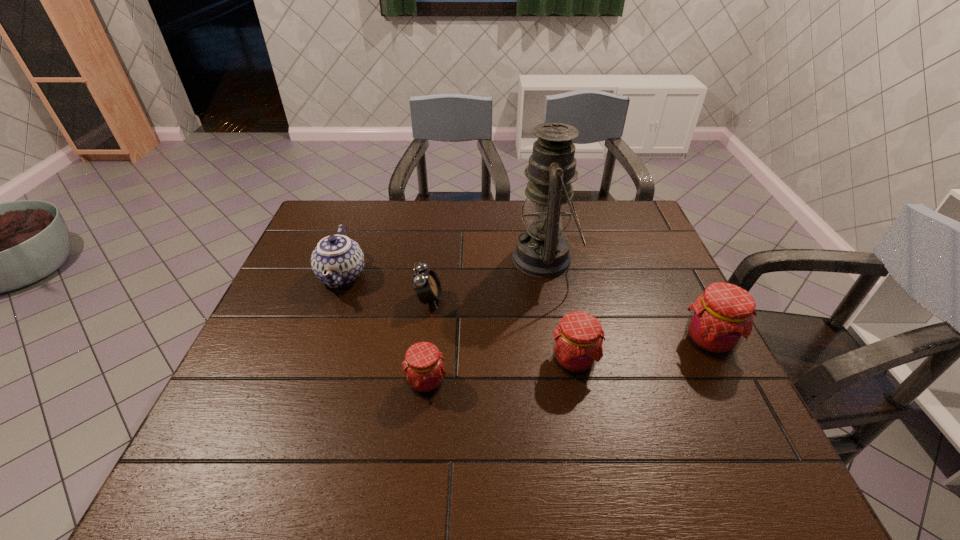
Locate an element on the screen. vacant area that lies between the tallest jam and the leftmost object is located at coordinates (525, 309).

Image resolution: width=960 pixels, height=540 pixels. I want to click on object that stands as the closest to the second jam from left to right, so click(x=542, y=251).

Locate an element on the screen. object that stands as the fifth closest to the tallest object is located at coordinates click(337, 261).

Locate which jam is the second closest to the alarm clock. Please provide its 2D coordinates. Your answer should be formatted as a tuple, i.e. [(x, y)], where the tuple contains the x and y coordinates of a point satisfying the conditions above.

[(577, 347)]

Identify which jam is the nearest to the shortest jam. Please provide its 2D coordinates. Your answer should be formatted as a tuple, i.e. [(x, y)], where the tuple contains the x and y coordinates of a point satisfying the conditions above.

[(577, 347)]

Where is `free location that satisfies the following two spatial constraints: 1. on the back side of the rightmost jam; 2. on the face of the alarm clock`? The image size is (960, 540). free location that satisfies the following two spatial constraints: 1. on the back side of the rightmost jam; 2. on the face of the alarm clock is located at coordinates (687, 299).

Image resolution: width=960 pixels, height=540 pixels. I want to click on vacant space that satisfies the following two spatial constraints: 1. on the back side of the second jam from left to right; 2. on the face of the alarm clock, so click(x=562, y=299).

Identify the location of free region that satisfies the following two spatial constraints: 1. on the face of the alarm clock; 2. on the left side of the second jam from left to right. This screenshot has height=540, width=960. (421, 361).

This screenshot has height=540, width=960. In order to click on vacant space that satisfies the following two spatial constraints: 1. from the spout of the second shortest jam; 2. on the left side of the leftmost object in this screenshot , I will do `click(311, 361)`.

Locate an element on the screen. Image resolution: width=960 pixels, height=540 pixels. vacant area that satisfies the following two spatial constraints: 1. on the face of the shortest jam; 2. on the right side of the alarm clock is located at coordinates (419, 383).